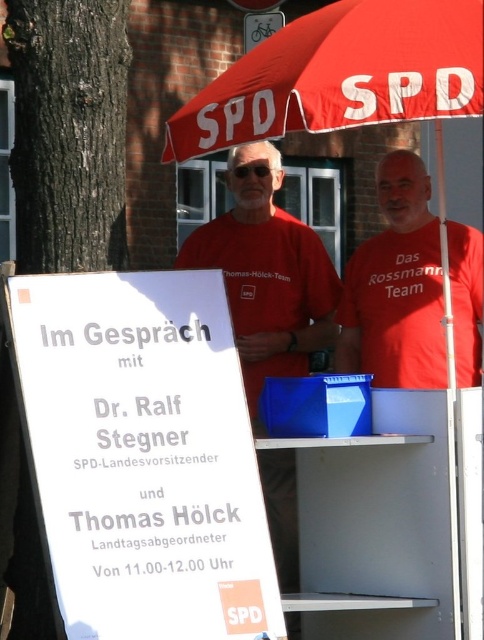
Who is positioned more to the right, red fabric umbrella at upper center or matte red shirt at center?

Positioned to the right is red fabric umbrella at upper center.

Is red fabric umbrella at upper center shorter than matte red shirt at center?

Correct, red fabric umbrella at upper center is not as tall as matte red shirt at center.

Locate an element on the screen. The height and width of the screenshot is (640, 484). red fabric umbrella at upper center is located at coordinates (342, 74).

Can you confirm if matte red shirt at center is positioned above matte red t-shirt at center?

Actually, matte red shirt at center is below matte red t-shirt at center.

Between point (282, 477) and point (380, 369), which one is positioned behind?

The point (380, 369) is behind.

What are the coordinates of `matte red shirt at center` in the screenshot? It's located at (267, 273).

Looking at this image, between red fabric umbrella at upper center and matte red t-shirt at center, which one is positioned lower?

matte red t-shirt at center is below.

Identify the location of red fabric umbrella at upper center. (342, 74).